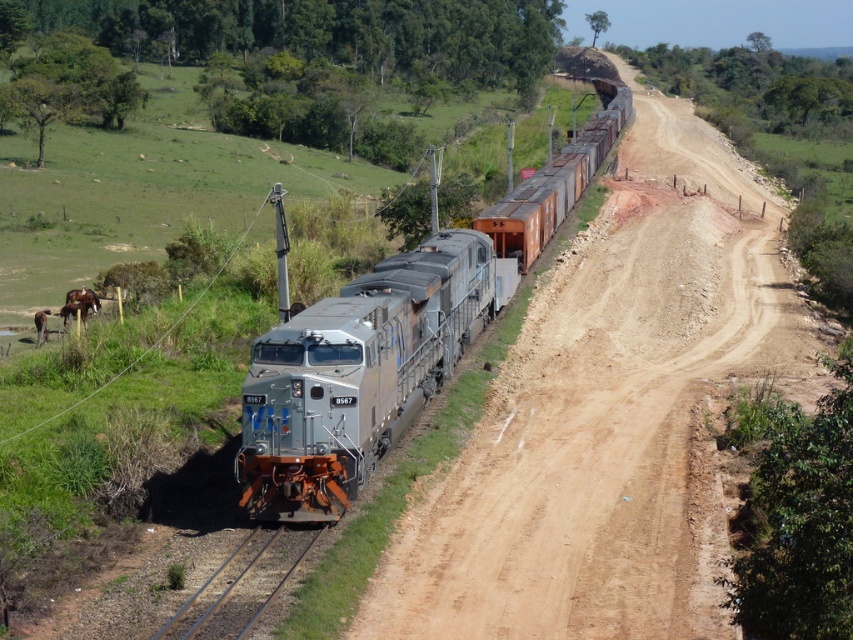
Question: Is brown dirt track at center-right positioned in front of silver metallic locomotive at center?

Choices:
 (A) yes
 (B) no

Answer: (A)

Question: Which of the following is the farthest from the observer?

Choices:
 (A) silver metallic locomotive at center
 (B) silver metallic train at center
 (C) brown dirt track at center-right

Answer: (B)

Question: Can you confirm if brown dirt track at center-right is positioned to the right of metal/smooth train track at lower center?

Choices:
 (A) yes
 (B) no

Answer: (A)

Question: Which object is positioned farthest from the metal/smooth train track at lower center?

Choices:
 (A) silver metallic train at center
 (B) silver metallic locomotive at center
 (C) brown dirt track at center-right

Answer: (C)

Question: Does brown dirt track at center-right lie behind silver metallic train at center?

Choices:
 (A) yes
 (B) no

Answer: (B)

Question: Which object appears closest to the camera in this image?

Choices:
 (A) silver metallic train at center
 (B) brown dirt track at center-right
 (C) metal/smooth train track at lower center
 (D) silver metallic locomotive at center

Answer: (B)